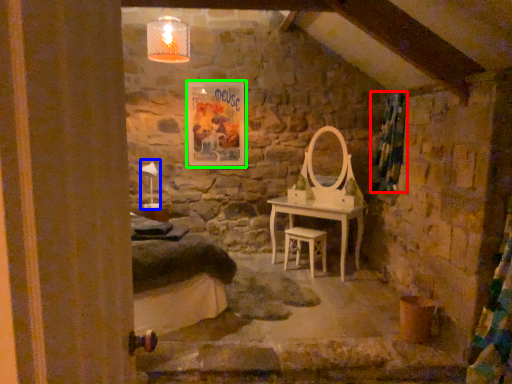
Question: Which object is positioned farthest from curtain (highlighted by a red box)? Select from table lamp (highlighted by a blue box) and picture frame (highlighted by a green box).

Choices:
 (A) table lamp
 (B) picture frame

Answer: (A)